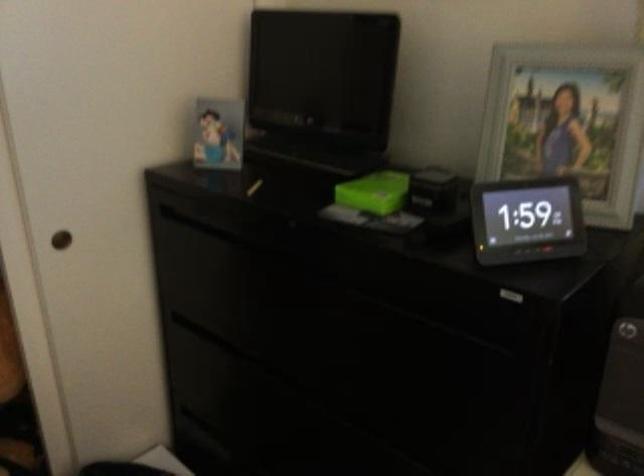
Where would you lift the small black box? Please return your answer as a coordinate pair (x, y).

(433, 190)